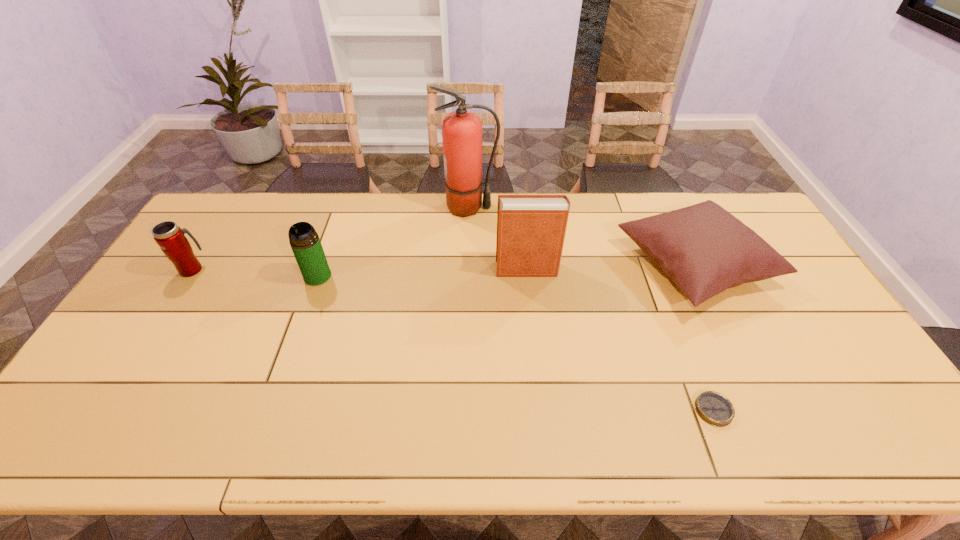
At what (x,y) coordinates should I click in order to perform the action: click on empty space between the shortest object and the cushion. Please return your answer as a coordinate pair (x, y). Image resolution: width=960 pixels, height=540 pixels. Looking at the image, I should click on (704, 338).

Where is `free point between the left thermos bottle and the second object from left to right`? free point between the left thermos bottle and the second object from left to right is located at coordinates (255, 273).

Identify the location of free spot between the cushion and the tallest object. (581, 237).

The height and width of the screenshot is (540, 960). I want to click on free space between the taller thermos bottle and the hardback book, so click(x=422, y=273).

The image size is (960, 540). Identify the location of unoccupied area between the hardback book and the leftmost object. (360, 269).

Identify the location of vacant space that is in between the nearest object and the fire extinguisher. (591, 309).

Where is `blank region between the taller thermos bottle and the fire extinguisher`? blank region between the taller thermos bottle and the fire extinguisher is located at coordinates (393, 242).

Locate an element on the screen. The height and width of the screenshot is (540, 960). unoccupied area between the fire extinguisher and the shortest object is located at coordinates (591, 309).

Identify which object is located as the fifth nearest to the right thermos bottle. Please provide its 2D coordinates. Your answer should be formatted as a tuple, i.e. [(x, y)], where the tuple contains the x and y coordinates of a point satisfying the conditions above.

[(714, 408)]

Locate an element on the screen. The width and height of the screenshot is (960, 540). object that is the fifth closest to the cushion is located at coordinates (170, 237).